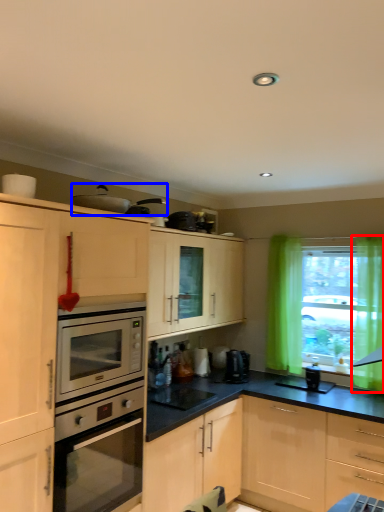
Question: Which object appears closest to the camera in this image, curtain (highlighted by a red box) or appliance (highlighted by a blue box)?

Choices:
 (A) curtain
 (B) appliance

Answer: (B)